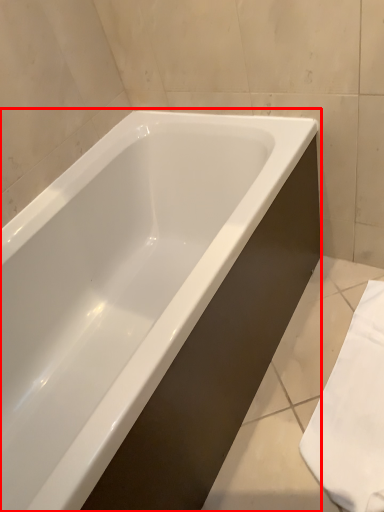
Question: From the image's perspective, what is the correct spatial relationship of bathtub (annotated by the red box) in relation to bath towel?

Choices:
 (A) below
 (B) above

Answer: (B)